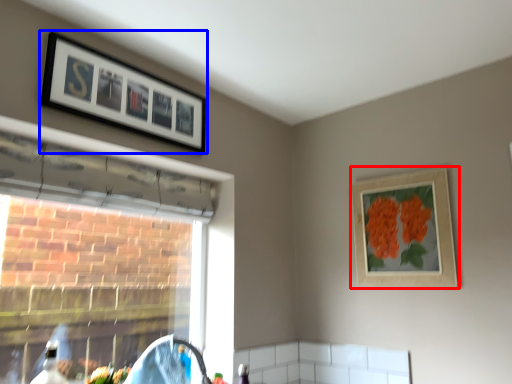
Question: Which object is closer to the camera taking this photo, picture frame (highlighted by a red box) or picture frame (highlighted by a blue box)?

Choices:
 (A) picture frame
 (B) picture frame

Answer: (B)